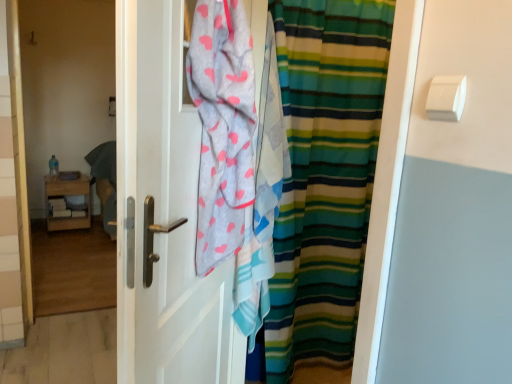
Question: Does light gray cotton towel at center have a smaller size compared to white matte door at center?

Choices:
 (A) no
 (B) yes

Answer: (B)

Question: Is light gray cotton towel at center not within white matte door at center?

Choices:
 (A) no
 (B) yes

Answer: (A)

Question: Are light gray cotton towel at center and white matte door at center beside each other?

Choices:
 (A) no
 (B) yes

Answer: (A)

Question: Is light gray cotton towel at center facing towards white matte door at center?

Choices:
 (A) no
 (B) yes

Answer: (A)

Question: Is light gray cotton towel at center taller than white matte door at center?

Choices:
 (A) no
 (B) yes

Answer: (A)

Question: Can you confirm if light gray cotton towel at center is shorter than white matte door at center?

Choices:
 (A) no
 (B) yes

Answer: (B)

Question: From the image's perspective, is light gray cotton towel at center located above teal fabric at left?

Choices:
 (A) yes
 (B) no

Answer: (B)

Question: Is light gray cotton towel at center next to teal fabric at left and touching it?

Choices:
 (A) yes
 (B) no

Answer: (B)

Question: Can you confirm if light gray cotton towel at center is thinner than teal fabric at left?

Choices:
 (A) no
 (B) yes

Answer: (A)

Question: Is light gray cotton towel at center positioned before teal fabric at left?

Choices:
 (A) no
 (B) yes

Answer: (B)

Question: Can you confirm if light gray cotton towel at center is shorter than teal fabric at left?

Choices:
 (A) yes
 (B) no

Answer: (B)

Question: From a real-world perspective, is light gray cotton towel at center under teal fabric at left?

Choices:
 (A) no
 (B) yes

Answer: (A)

Question: Can you confirm if teal fabric at left is wider than light gray cotton towel at center?

Choices:
 (A) yes
 (B) no

Answer: (B)